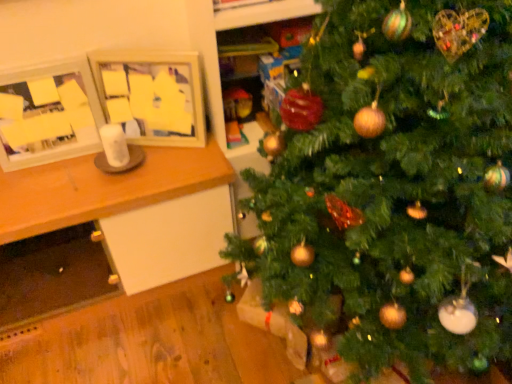
What do you see at coordinates (102, 188) in the screenshot?
I see `wooden table at left` at bounding box center [102, 188].

Locate an element on the screen. The width and height of the screenshot is (512, 384). green matte christmas tree at center is located at coordinates (393, 187).

What are the coordinates of `wooden picture frame at upper left, acting as the second picture frame starting from the left` in the screenshot? It's located at (152, 95).

The width and height of the screenshot is (512, 384). In order to click on wooden table at left in this screenshot , I will do 102,188.

From the image's perspective, which one is positioned lower, matte wooden picture frame at left, the second picture frame from the right, or wooden table at left?

wooden table at left is shown below in the image.

Which of these two, matte wooden picture frame at left, the second picture frame from the right, or wooden table at left, is bigger?

wooden table at left.

Which of these two, matte wooden picture frame at left, the second picture frame from the right, or wooden table at left, stands taller?

Standing taller between the two is wooden table at left.

Is matte wooden picture frame at left, the second picture frame from the right, spatially inside wooden table at left, or outside of it?

matte wooden picture frame at left, the second picture frame from the right, is outside wooden table at left.

What's the angular difference between wooden picture frame at upper left, marked as the 1th picture frame in a right-to-left arrangement, and wooden table at left's facing directions?

There is a 27-degree angle between the facing directions of wooden picture frame at upper left, marked as the 1th picture frame in a right-to-left arrangement, and wooden table at left.

Who is taller, wooden picture frame at upper left, acting as the second picture frame starting from the left, or wooden table at left?

wooden table at left.

Image resolution: width=512 pixels, height=384 pixels. Find the location of `table below the wooden picture frame at upper left, acting as the second picture frame starting from the left (from a real-world perspective)`. table below the wooden picture frame at upper left, acting as the second picture frame starting from the left (from a real-world perspective) is located at coordinates (102, 188).

From the image's perspective, is wooden picture frame at upper left, marked as the 1th picture frame in a right-to-left arrangement, under wooden table at left?

No, from the image's perspective, wooden picture frame at upper left, marked as the 1th picture frame in a right-to-left arrangement, is not beneath wooden table at left.

Is wooden picture frame at upper left, acting as the second picture frame starting from the left, outside of green matte christmas tree at center?

wooden picture frame at upper left, acting as the second picture frame starting from the left, lies outside green matte christmas tree at center's area.

Is wooden picture frame at upper left, marked as the 1th picture frame in a right-to-left arrangement, not near green matte christmas tree at center?

No, wooden picture frame at upper left, marked as the 1th picture frame in a right-to-left arrangement, is not far from green matte christmas tree at center.

From the picture: Can you tell me how much wooden picture frame at upper left, marked as the 1th picture frame in a right-to-left arrangement, and green matte christmas tree at center differ in facing direction?

62.7 degrees.

Who is bigger, matte wooden picture frame at left, the first picture frame viewed from the left, or wooden picture frame at upper left, marked as the 1th picture frame in a right-to-left arrangement?

Bigger between the two is matte wooden picture frame at left, the first picture frame viewed from the left.

From a real-world perspective, is matte wooden picture frame at left, the first picture frame viewed from the left, over wooden picture frame at upper left, marked as the 1th picture frame in a right-to-left arrangement?

Yes.

From the picture: Is matte wooden picture frame at left, the first picture frame viewed from the left, positioned with its back to wooden picture frame at upper left, acting as the second picture frame starting from the left?

No, wooden picture frame at upper left, acting as the second picture frame starting from the left, is not at the back of matte wooden picture frame at left, the first picture frame viewed from the left.

Is matte wooden picture frame at left, the first picture frame viewed from the left, positioned beyond the bounds of wooden picture frame at upper left, acting as the second picture frame starting from the left?

Yes, matte wooden picture frame at left, the first picture frame viewed from the left, is outside of wooden picture frame at upper left, acting as the second picture frame starting from the left.

In the scene shown: Which of these two, matte wooden picture frame at left, the second picture frame from the right, or green matte christmas tree at center, stands shorter?

matte wooden picture frame at left, the second picture frame from the right, is shorter.

Considering the sizes of matte wooden picture frame at left, the second picture frame from the right, and green matte christmas tree at center in the image, is matte wooden picture frame at left, the second picture frame from the right, wider or thinner than green matte christmas tree at center?

In the image, matte wooden picture frame at left, the second picture frame from the right, appears to be more narrow than green matte christmas tree at center.

Could you tell me if matte wooden picture frame at left, the second picture frame from the right, is facing green matte christmas tree at center?

No.

Is point (38, 161) in front of point (500, 158)?

No, it is not.

Measure the distance between green matte christmas tree at center and wooden table at left.

green matte christmas tree at center and wooden table at left are 21.79 inches apart.

How different are the orientations of green matte christmas tree at center and wooden table at left in degrees?

89.6 degrees.

Which is more to the right, green matte christmas tree at center or wooden table at left?

green matte christmas tree at center.

Between green matte christmas tree at center and wooden table at left, which one has smaller width?

Thinner between the two is wooden table at left.

Between wooden table at left and wooden picture frame at upper left, marked as the 1th picture frame in a right-to-left arrangement, which one has larger width?

With larger width is wooden table at left.

Would you consider wooden table at left to be distant from wooden picture frame at upper left, marked as the 1th picture frame in a right-to-left arrangement?

That's not correct — wooden table at left is a little close to wooden picture frame at upper left, marked as the 1th picture frame in a right-to-left arrangement.

Is wooden table at left positioned before wooden picture frame at upper left, acting as the second picture frame starting from the left?

Yes.

Between wooden table at left and wooden picture frame at upper left, acting as the second picture frame starting from the left, which one has more height?

Standing taller between the two is wooden table at left.

From the wooden table at left, count 1st picture frames backward and point to it. Please provide its 2D coordinates.

[(48, 115)]

The width and height of the screenshot is (512, 384). I want to click on picture frame on the right of wooden table at left, so click(152, 95).

Looking at the image, which one is located further to matte wooden picture frame at left, the first picture frame viewed from the left, wooden table at left or green matte christmas tree at center?

Based on the image, green matte christmas tree at center appears to be further to matte wooden picture frame at left, the first picture frame viewed from the left.

Looking at the image, which one is located further to wooden table at left, matte wooden picture frame at left, the first picture frame viewed from the left, or green matte christmas tree at center?

green matte christmas tree at center.

When comparing their distances from green matte christmas tree at center, does matte wooden picture frame at left, the second picture frame from the right, or wooden picture frame at upper left, marked as the 1th picture frame in a right-to-left arrangement, seem closer?

wooden picture frame at upper left, marked as the 1th picture frame in a right-to-left arrangement, is closer to green matte christmas tree at center.

Looking at the image, which one is located closer to wooden picture frame at upper left, acting as the second picture frame starting from the left, wooden table at left or green matte christmas tree at center?

wooden table at left.

Which object lies further to the anchor point wooden picture frame at upper left, marked as the 1th picture frame in a right-to-left arrangement, matte wooden picture frame at left, the first picture frame viewed from the left, or wooden table at left?

Among the two, wooden table at left is located further to wooden picture frame at upper left, marked as the 1th picture frame in a right-to-left arrangement.

Considering their positions, is green matte christmas tree at center positioned further to matte wooden picture frame at left, the first picture frame viewed from the left, than wooden table at left?

Based on the image, green matte christmas tree at center appears to be further to matte wooden picture frame at left, the first picture frame viewed from the left.

Estimate the real-world distances between objects in this image. Which object is further from wooden picture frame at upper left, acting as the second picture frame starting from the left, green matte christmas tree at center or matte wooden picture frame at left, the second picture frame from the right?

The object further to wooden picture frame at upper left, acting as the second picture frame starting from the left, is green matte christmas tree at center.

Estimate the real-world distances between objects in this image. Which object is closer to wooden table at left, wooden picture frame at upper left, acting as the second picture frame starting from the left, or matte wooden picture frame at left, the second picture frame from the right?

Among the two, matte wooden picture frame at left, the second picture frame from the right, is located nearer to wooden table at left.

At what (x,y) coordinates should I click in order to perform the action: click on table between matte wooden picture frame at left, the second picture frame from the right, and green matte christmas tree at center from left to right. Please return your answer as a coordinate pair (x, y). This screenshot has width=512, height=384. Looking at the image, I should click on (102, 188).

Image resolution: width=512 pixels, height=384 pixels. What are the coordinates of `picture frame that lies between wooden picture frame at upper left, acting as the second picture frame starting from the left, and wooden table at left from top to bottom` in the screenshot? It's located at (48, 115).

This screenshot has height=384, width=512. Identify the location of table located between green matte christmas tree at center and wooden picture frame at upper left, marked as the 1th picture frame in a right-to-left arrangement, in the depth direction. (102, 188).

At what (x,y) coordinates should I click in order to perform the action: click on picture frame between green matte christmas tree at center and wooden picture frame at upper left, acting as the second picture frame starting from the left, in the front-back direction. Please return your answer as a coordinate pair (x, y). This screenshot has height=384, width=512. Looking at the image, I should click on (48, 115).